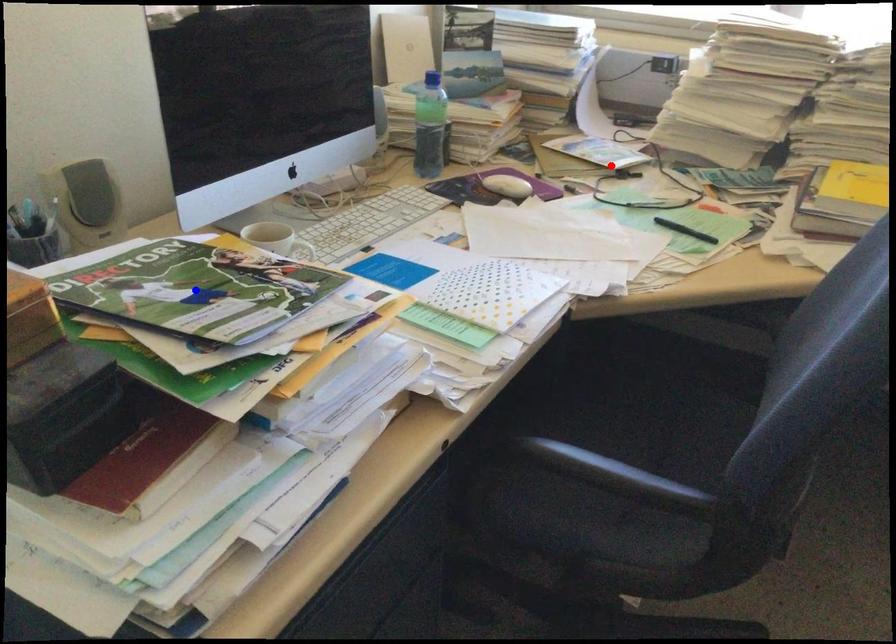
Question: Which of the two points in the image is closer to the camera?

Choices:
 (A) Blue point is closer.
 (B) Red point is closer.

Answer: (A)